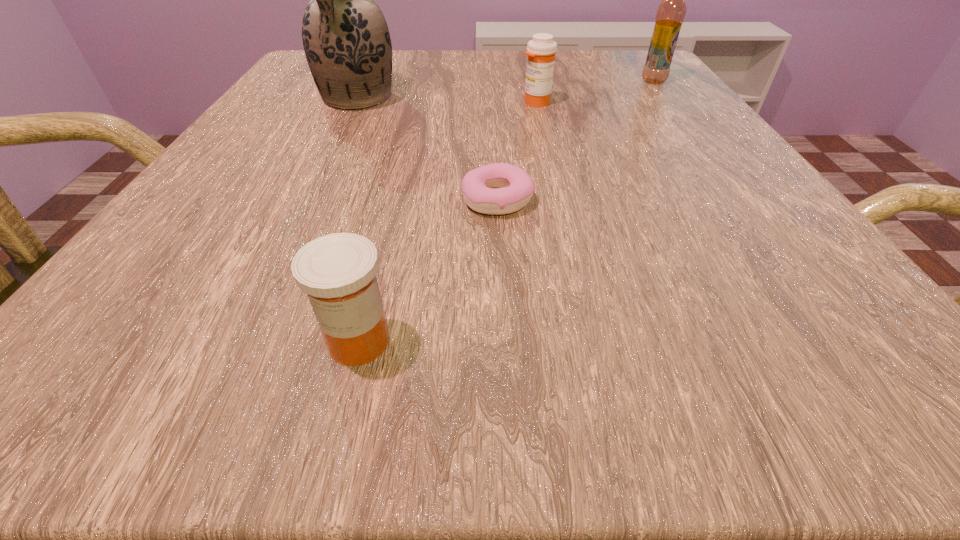
The height and width of the screenshot is (540, 960). I want to click on vacant space located with the handle on the side of the leftmost object, so click(x=297, y=222).

The height and width of the screenshot is (540, 960). I want to click on free location located on the left of the bottle, so click(x=509, y=81).

This screenshot has width=960, height=540. Find the location of `vacant space located 0.090m on the right of the second object from right to left`. vacant space located 0.090m on the right of the second object from right to left is located at coordinates (601, 103).

Where is `vacant space located on the front of the pastry`? The height and width of the screenshot is (540, 960). vacant space located on the front of the pastry is located at coordinates (502, 290).

In order to click on vase that is positioned at the far edge in this screenshot , I will do `click(346, 40)`.

The width and height of the screenshot is (960, 540). In order to click on bottle positioned at the far edge in this screenshot , I will do pyautogui.click(x=671, y=12).

The height and width of the screenshot is (540, 960). In order to click on object located at the near edge in this screenshot , I will do `click(338, 271)`.

Find the location of a particular element. Image resolution: width=960 pixels, height=540 pixels. object that is at the left edge is located at coordinates (x=346, y=40).

The height and width of the screenshot is (540, 960). In order to click on object situated at the right edge in this screenshot , I will do `click(671, 12)`.

This screenshot has width=960, height=540. What are the coordinates of `object present at the far left corner` in the screenshot? It's located at (346, 40).